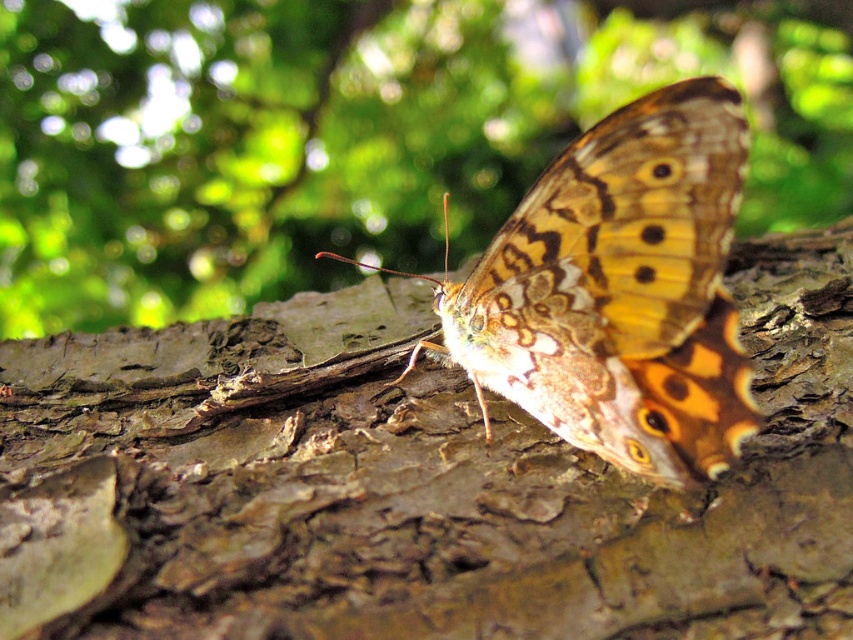
Question: Can you confirm if brown rough bark at center is positioned to the left of brown textured butterfly at center?

Choices:
 (A) yes
 (B) no

Answer: (A)

Question: Which point is closer to the camera?

Choices:
 (A) (834, 456)
 (B) (675, 312)

Answer: (B)

Question: Which of the following is the farthest from the observer?

Choices:
 (A) (480, 483)
 (B) (498, 294)

Answer: (B)

Question: Does brown rough bark at center have a larger size compared to brown textured butterfly at center?

Choices:
 (A) yes
 (B) no

Answer: (A)

Question: Does brown rough bark at center lie in front of brown textured butterfly at center?

Choices:
 (A) no
 (B) yes

Answer: (B)

Question: Among these objects, which one is nearest to the camera?

Choices:
 (A) brown rough bark at center
 (B) brown textured butterfly at center

Answer: (A)